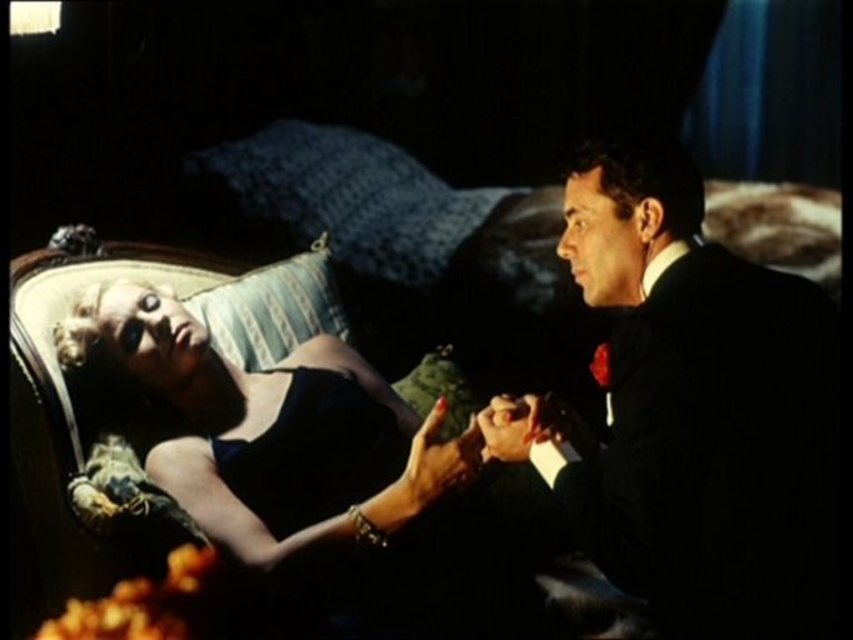
Question: Which point is closer to the camera taking this photo?

Choices:
 (A) (430, 464)
 (B) (560, 525)

Answer: (A)

Question: Can you confirm if shiny black dress at center is smaller than shiny black suit at right?

Choices:
 (A) yes
 (B) no

Answer: (B)

Question: Can you confirm if shiny black suit at right is positioned above matte black dress at center?

Choices:
 (A) yes
 (B) no

Answer: (B)

Question: Estimate the real-world distances between objects in this image. Which object is closer to the shiny black suit at right?

Choices:
 (A) shiny black dress at center
 (B) matte black dress at center

Answer: (A)

Question: Which of these objects is positioned closest to the shiny black dress at center?

Choices:
 (A) matte black dress at center
 (B) shiny black suit at right

Answer: (A)

Question: Can you confirm if shiny black dress at center is bigger than shiny black suit at right?

Choices:
 (A) yes
 (B) no

Answer: (A)